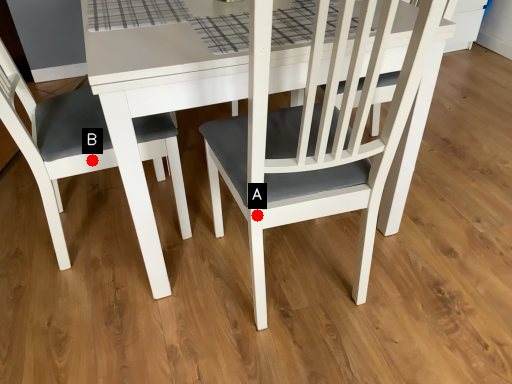
Question: Two points are circled on the image, labeled by A and B beside each circle. Which point is closer to the camera taking this photo?

Choices:
 (A) A is closer
 (B) B is closer

Answer: (A)